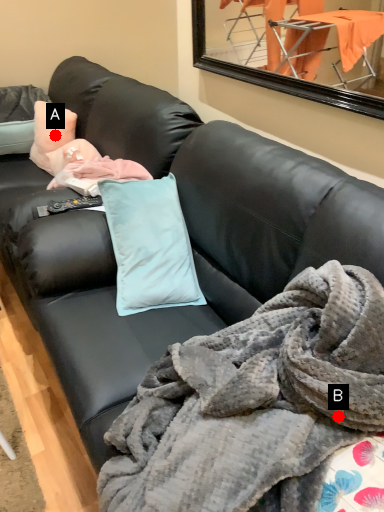
Question: Two points are circled on the image, labeled by A and B beside each circle. Among these points, which one is farthest from the camera?

Choices:
 (A) A is further
 (B) B is further

Answer: (A)